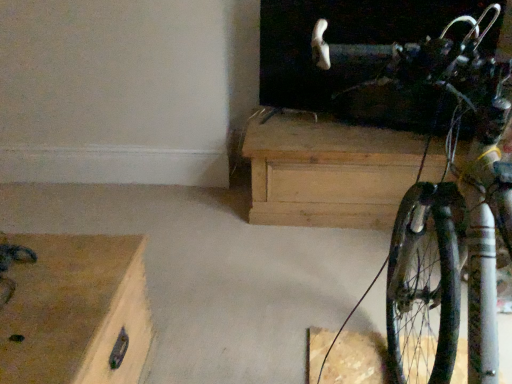
Question: Is the position of shiny metallic bicycle at right more distant than that of natural wood chest at center, which ranks as the first chest of drawers in top-to-bottom order?

Choices:
 (A) no
 (B) yes

Answer: (A)

Question: Is shiny metallic bicycle at right far away from natural wood chest at center, which is counted as the 2th chest of drawers, starting from the front?

Choices:
 (A) yes
 (B) no

Answer: (B)

Question: Is shiny metallic bicycle at right positioned with its back to natural wood chest at center, arranged as the first chest of drawers when viewed from the right?

Choices:
 (A) no
 (B) yes

Answer: (A)

Question: Considering the relative sizes of shiny metallic bicycle at right and natural wood chest at center, the second chest of drawers positioned from the left, in the image provided, is shiny metallic bicycle at right wider than natural wood chest at center, the second chest of drawers positioned from the left,?

Choices:
 (A) yes
 (B) no

Answer: (A)

Question: Is shiny metallic bicycle at right aimed at natural wood chest at center, positioned as the second chest of drawers in bottom-to-top order?

Choices:
 (A) no
 (B) yes

Answer: (B)

Question: Is point (250, 150) positioned closer to the camera than point (66, 271)?

Choices:
 (A) farther
 (B) closer

Answer: (A)

Question: Considering their positions, is natural wood chest at center, which ranks as the first chest of drawers in top-to-bottom order, located in front of or behind wooden chest at lower left, which is the first chest of drawers from left to right?

Choices:
 (A) behind
 (B) front

Answer: (A)

Question: From a real-world perspective, relative to wooden chest at lower left, the 2th chest of drawers viewed from the right, is natural wood chest at center, which ranks as the first chest of drawers in top-to-bottom order, vertically above or below?

Choices:
 (A) above
 (B) below

Answer: (A)

Question: Is natural wood chest at center, arranged as the first chest of drawers when viewed from the right, inside the boundaries of wooden chest at lower left, which appears as the 2th chest of drawers when viewed from the back, or outside?

Choices:
 (A) outside
 (B) inside

Answer: (A)

Question: Do you think natural wood chest at center, positioned as the second chest of drawers in bottom-to-top order, is within shiny metallic bicycle at right, or outside of it?

Choices:
 (A) inside
 (B) outside

Answer: (B)

Question: In the image, is natural wood chest at center, arranged as the first chest of drawers when viewed from the right, on the left side or the right side of shiny metallic bicycle at right?

Choices:
 (A) right
 (B) left

Answer: (A)

Question: Does point (329, 188) appear closer or farther from the camera than point (403, 198)?

Choices:
 (A) closer
 (B) farther

Answer: (B)

Question: In terms of height, does natural wood chest at center, arranged as the first chest of drawers when viewed from the right, look taller or shorter compared to shiny metallic bicycle at right?

Choices:
 (A) short
 (B) tall

Answer: (A)

Question: Is wooden chest at lower left, arranged as the second chest of drawers when viewed from the top, in front of or behind natural wood chest at center, the second chest of drawers positioned from the left, in the image?

Choices:
 (A) front
 (B) behind

Answer: (A)

Question: From a real-world perspective, is wooden chest at lower left, the 2th chest of drawers viewed from the right, above or below natural wood chest at center, the second chest of drawers positioned from the left?

Choices:
 (A) above
 (B) below

Answer: (B)